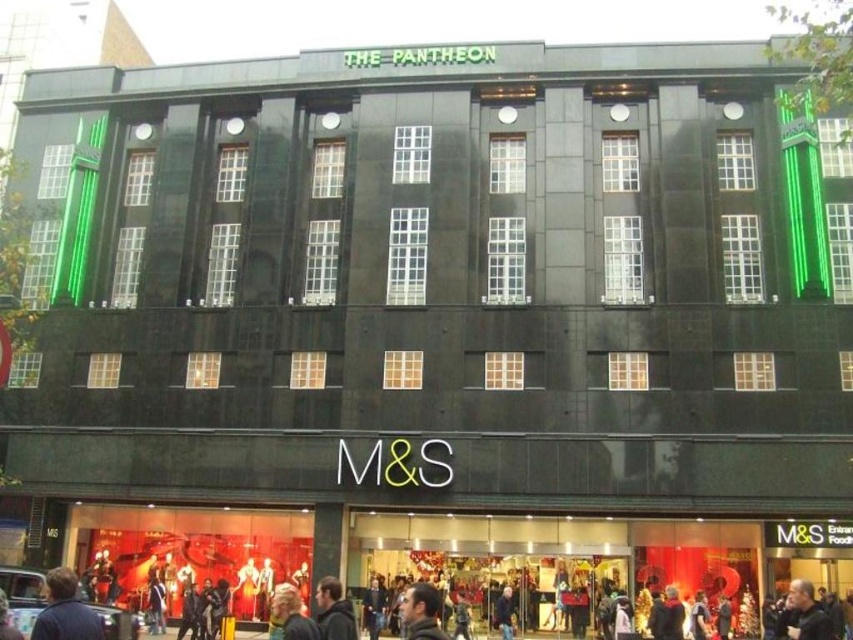
You are standing in front of the building and see two points marked on the facade. The first point is at coordinate point(799, 602) and the second is at point(409, 589). Which point is closer to you?

Point(799, 602) is in front of point(409, 589), so it is closer to you.

You are standing in front of the building and want to find the dark blue jacket at lower left. According to the coordinates provided, where exactly should you look on the image to locate it?

The dark blue jacket at lower left is located at coordinates point (65,611).

You are standing at the camera position looking at the building. There is a point at coordinates point (824, 620). Can you determine if this point is closer to you or farther away than 40 meters?

The distance between point (824, 620) and the camera is 38.17 meters, which is less than 40 meters. Therefore, the point is closer to you than 40 meters.